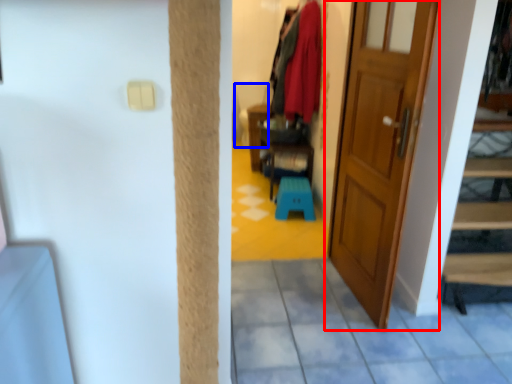
Question: Which of the following is the farthest to the observer, door (highlighted by a red box) or armchair (highlighted by a blue box)?

Choices:
 (A) door
 (B) armchair

Answer: (B)